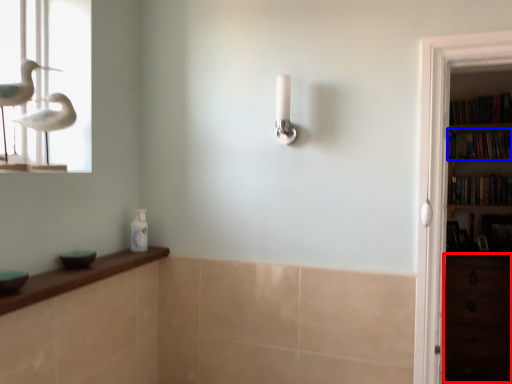
Question: Which point is further to the camera, drawer (highlighted by a red box) or book (highlighted by a blue box)?

Choices:
 (A) drawer
 (B) book

Answer: (B)